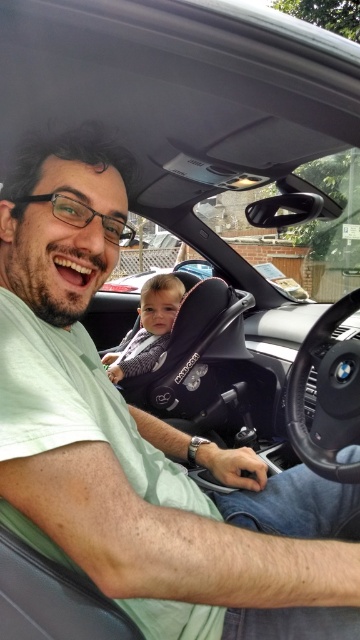
Question: Which object is closer to the camera taking this photo?

Choices:
 (A) black leather steering wheel at center
 (B) soft gray fabric baby car seat at center

Answer: (A)

Question: Which point is closer to the camera taking this photo?

Choices:
 (A) [x=326, y=314]
 (B) [x=171, y=326]

Answer: (A)

Question: Can you confirm if black leather steering wheel at center is positioned above soft gray fabric baby car seat at center?

Choices:
 (A) no
 (B) yes

Answer: (A)

Question: Is black leather steering wheel at center to the left of soft gray fabric baby car seat at center from the viewer's perspective?

Choices:
 (A) no
 (B) yes

Answer: (A)

Question: Is black leather steering wheel at center closer to camera compared to soft gray fabric baby car seat at center?

Choices:
 (A) no
 (B) yes

Answer: (B)